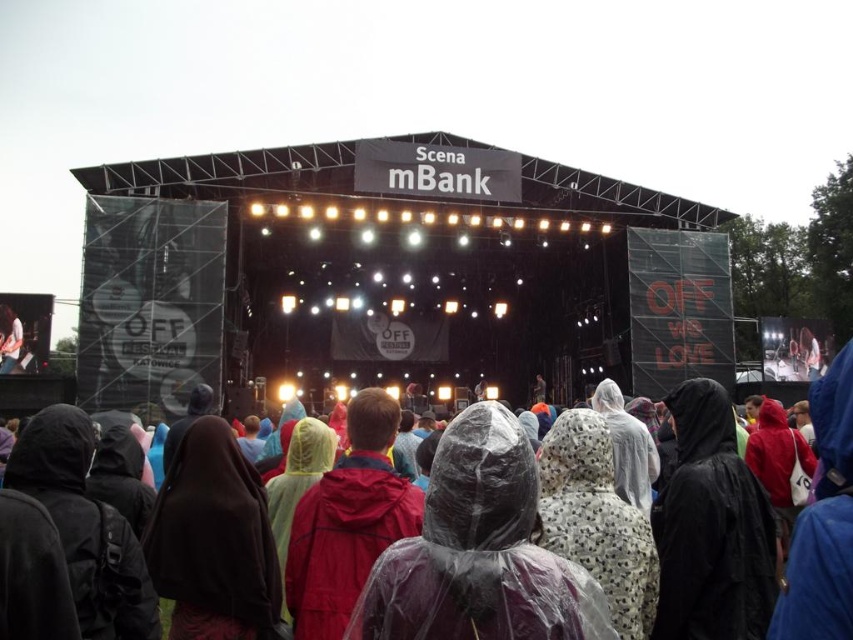
Does transparent plastic poncho at center come in front of white glossy shoe at center?

Yes, it is.

Does transparent plastic poncho at center have a larger size compared to white glossy shoe at center?

Indeed, transparent plastic poncho at center has a larger size compared to white glossy shoe at center.

What do you see at coordinates (822, 520) in the screenshot?
I see `transparent plastic poncho at center` at bounding box center [822, 520].

Identify the location of transparent plastic poncho at center. The image size is (853, 640). (822, 520).